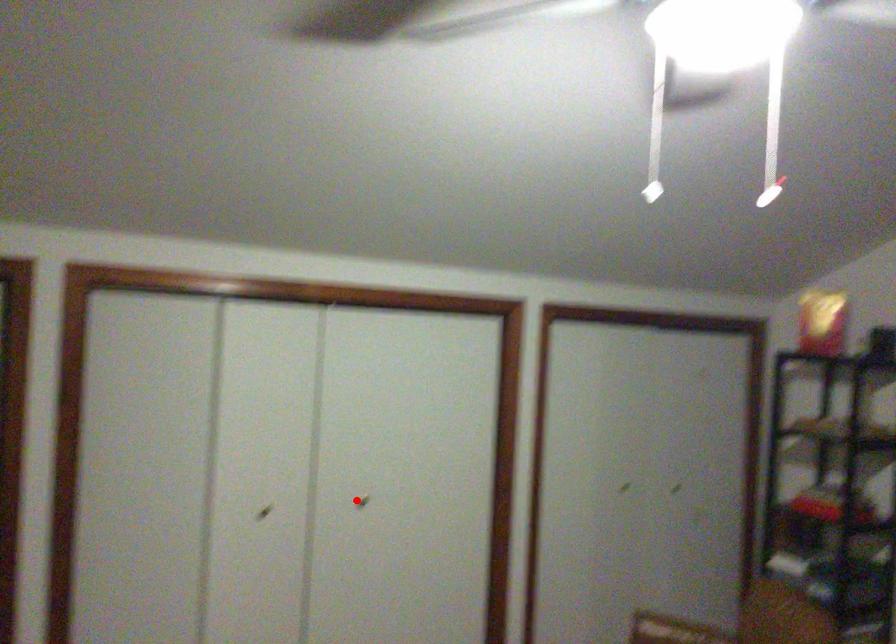
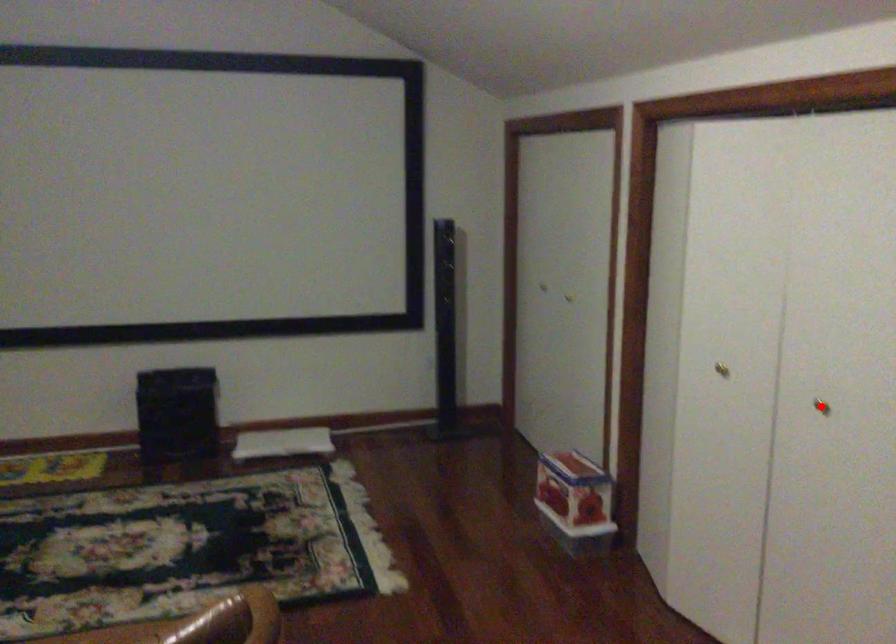
I am providing you with two images of the same scene from different viewpoints. A red point is marked on the first image and another point is marked on the second image. Is the red point in image1 aligned with the point shown in image2?

Yes